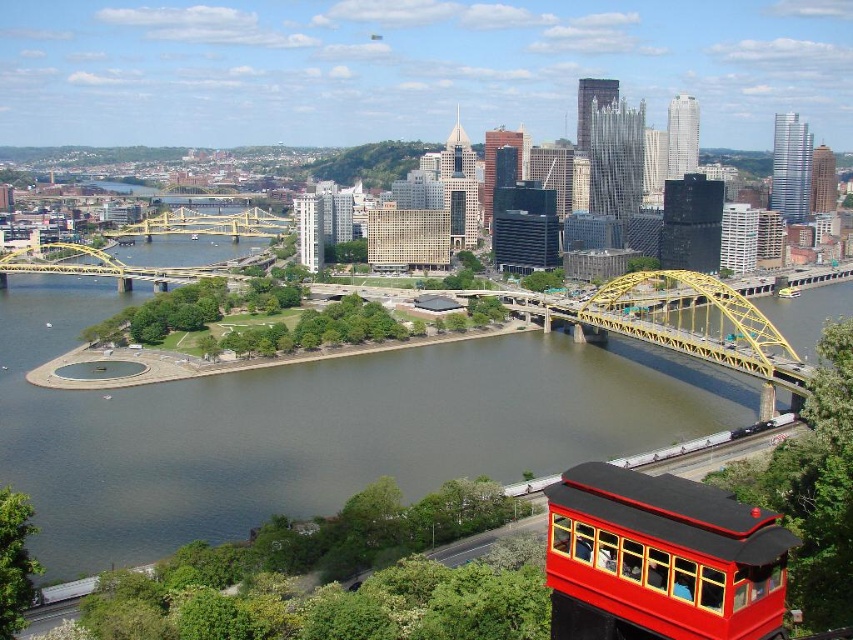
Based on the photo, can you confirm if brown water at center is taller than shiny red trolley car at lower right?

Correct, brown water at center is much taller as shiny red trolley car at lower right.

Is brown water at center below shiny red trolley car at lower right?

No.

Locate an element on the screen. The width and height of the screenshot is (853, 640). brown water at center is located at coordinates (312, 428).